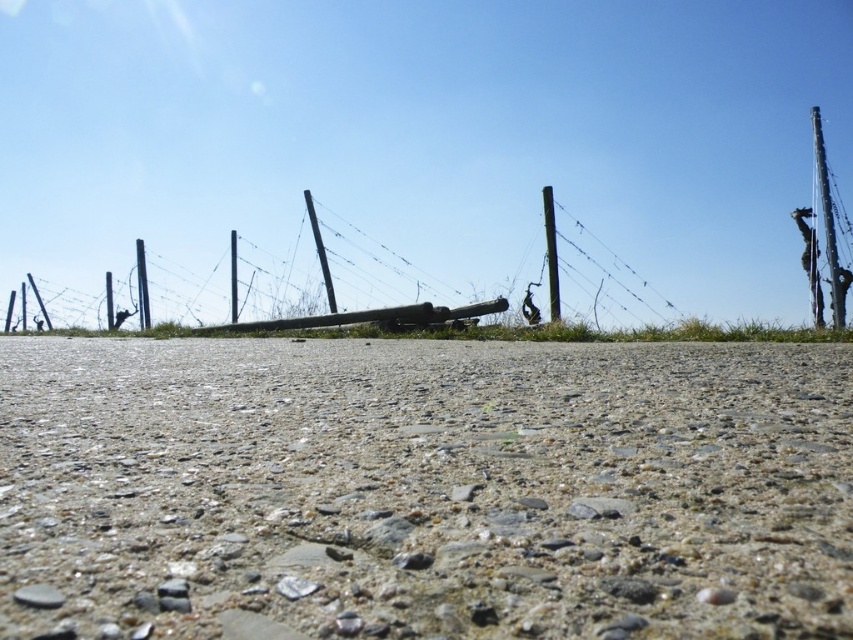
Based on the photo, between rusty metal telegraph pole at upper right and smooth wood pole at center, which one is positioned higher?

Positioned higher is rusty metal telegraph pole at upper right.

Is point (843, 307) farther from camera compared to point (231, 275)?

No, it is not.

In order to click on rusty metal telegraph pole at upper right in this screenshot , I will do `click(827, 221)`.

Between gray gravel at center and smooth black pole at center, which one is positioned higher?

Positioned higher is smooth black pole at center.

Is gray gravel at center below smooth black pole at center?

Correct, gray gravel at center is located below smooth black pole at center.

What do you see at coordinates (422, 490) in the screenshot?
I see `gray gravel at center` at bounding box center [422, 490].

Locate an element on the screen. The image size is (853, 640). gray gravel at center is located at coordinates (422, 490).

How distant is wire mesh fence at center from smooth black pole at center?

wire mesh fence at center is 21.44 meters away from smooth black pole at center.

Does wire mesh fence at center appear over smooth black pole at center?

Correct, wire mesh fence at center is located above smooth black pole at center.

Where is `wire mesh fence at center`? Image resolution: width=853 pixels, height=640 pixels. wire mesh fence at center is located at coordinates (604, 273).